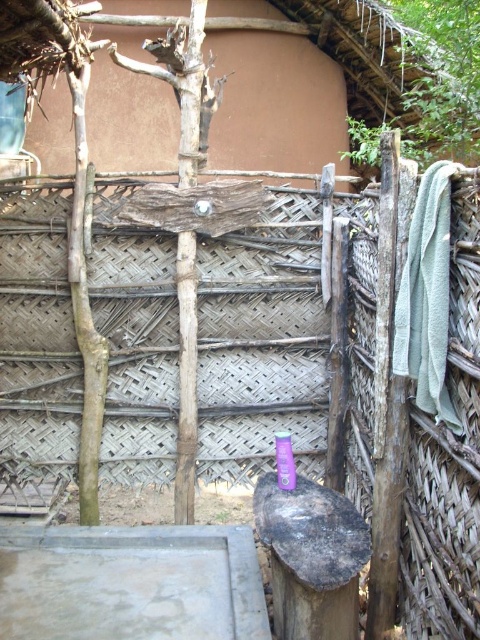
This screenshot has height=640, width=480. In order to click on green terry towel at right in this screenshot , I will do `click(427, 296)`.

Who is more forward, (417,392) or (292,456)?

Point (417,392)

At what (x,y) coordinates should I click in order to perform the action: click on green terry towel at right. Please return your answer as a coordinate pair (x, y). The height and width of the screenshot is (640, 480). Looking at the image, I should click on (427, 296).